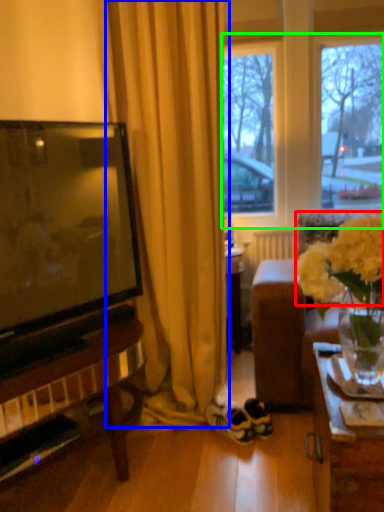
Question: Considering the real-world distances, which object is closest to flower (highlighted by a red box)? curtain (highlighted by a blue box) or window frame (highlighted by a green box).

Choices:
 (A) curtain
 (B) window frame

Answer: (A)